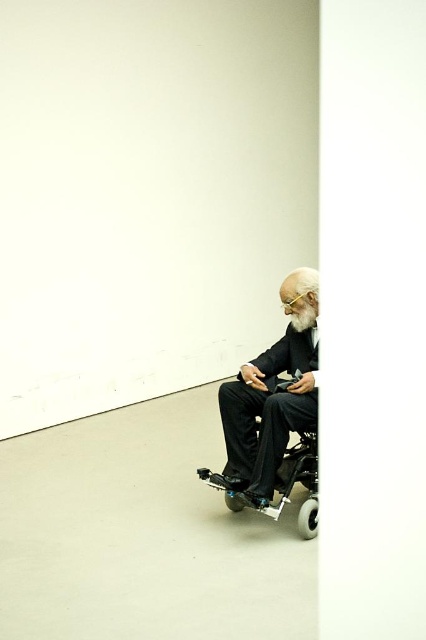
Question: Is black matte wheelchair at right above black plastic wheelchair at lower right?

Choices:
 (A) no
 (B) yes

Answer: (B)

Question: Which object appears closest to the camera in this image?

Choices:
 (A) black plastic wheelchair at lower right
 (B) black matte wheelchair at right

Answer: (B)

Question: Can you confirm if black matte wheelchair at right is positioned below black plastic wheelchair at lower right?

Choices:
 (A) yes
 (B) no

Answer: (B)

Question: Is black matte wheelchair at right smaller than black plastic wheelchair at lower right?

Choices:
 (A) no
 (B) yes

Answer: (A)